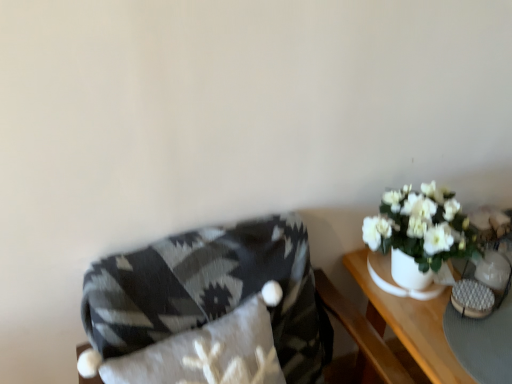
Question: Is textured gray blanket at left to the left or to the right of white ceramic vase at right in the image?

Choices:
 (A) left
 (B) right

Answer: (A)

Question: Based on their sizes in the image, would you say textured gray blanket at left is bigger or smaller than white ceramic vase at right?

Choices:
 (A) small
 (B) big

Answer: (B)

Question: Which is nearer to the white ceramic vase at right?

Choices:
 (A) textured gray blanket at left
 (B) white ceramic table at right

Answer: (B)

Question: Which object is the closest to the white ceramic table at right?

Choices:
 (A) textured gray blanket at left
 (B) white ceramic vase at right

Answer: (B)